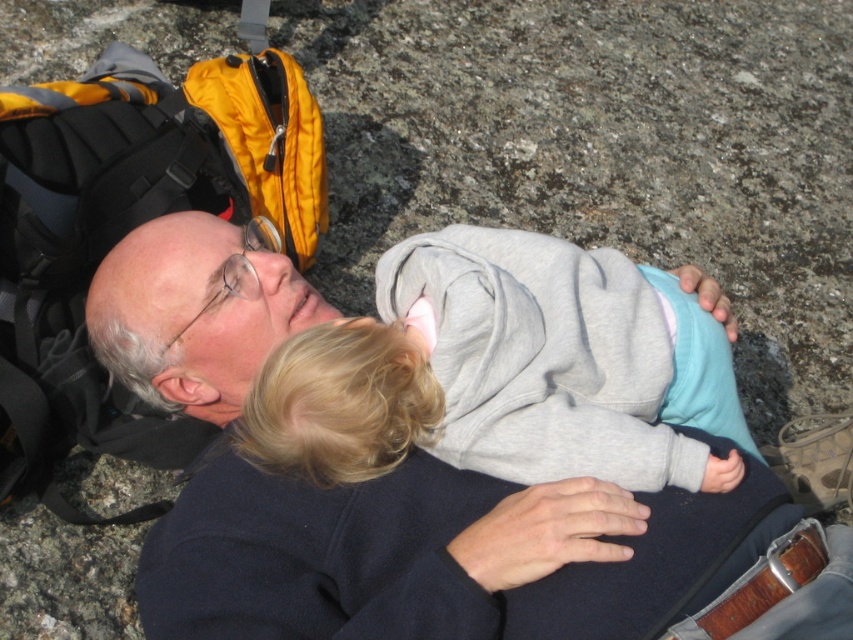
Question: Which of the following is the closest to the observer?

Choices:
 (A) (318, 384)
 (B) (161, 570)

Answer: (A)

Question: Does dark blue sweater at center have a larger size compared to gray fleece jacket at center?

Choices:
 (A) no
 (B) yes

Answer: (B)

Question: Which of the following is the farthest from the observer?

Choices:
 (A) (410, 403)
 (B) (405, 464)

Answer: (B)

Question: Which of the following is the closest to the observer?

Choices:
 (A) (549, 371)
 (B) (555, 554)

Answer: (B)

Question: Does dark blue sweater at center have a smaller size compared to gray fleece jacket at center?

Choices:
 (A) yes
 (B) no

Answer: (B)

Question: Is dark blue sweater at center positioned in front of gray fleece jacket at center?

Choices:
 (A) yes
 (B) no

Answer: (A)